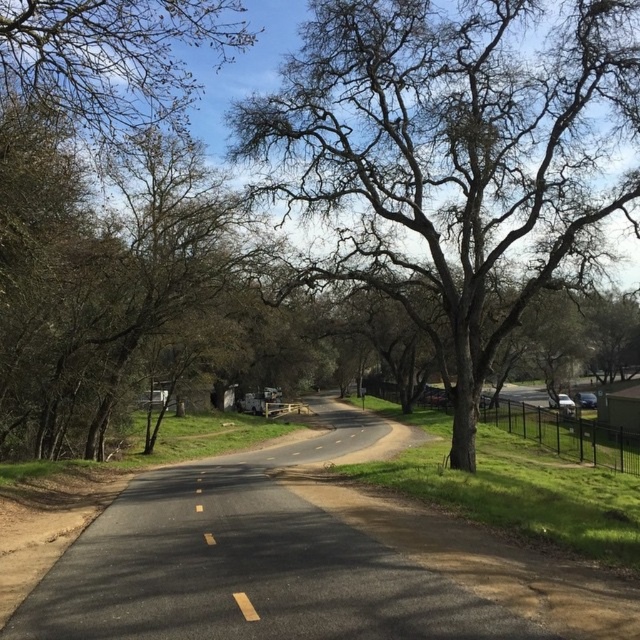
You are standing at the point labeled point [35,1] on the road. You want to walk to the fence on the right side of the road. How far will you have to walk to reach the fence?

The distance between point [35,1] and the viewer is 8.72 meters, so you will have to walk 8.72 meters to reach the fence on the right side of the road.

You are a hiker walking along the road and notice two sets of bare branches in the scene. Which set of bare branches, the bare branches at center or the bare branches at upper left, appears bigger in size?

The bare branches at center appears bigger in size compared to the bare branches at upper left.